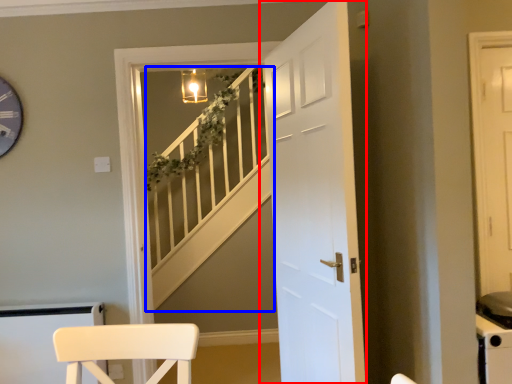
Question: Which object is closer to the camera taking this photo, door (highlighted by a red box) or stairwell (highlighted by a blue box)?

Choices:
 (A) door
 (B) stairwell

Answer: (A)